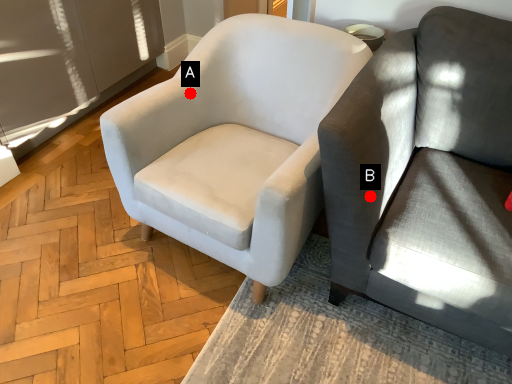
Question: Two points are circled on the image, labeled by A and B beside each circle. Which of the following is the closest to the observer?

Choices:
 (A) A is closer
 (B) B is closer

Answer: (B)